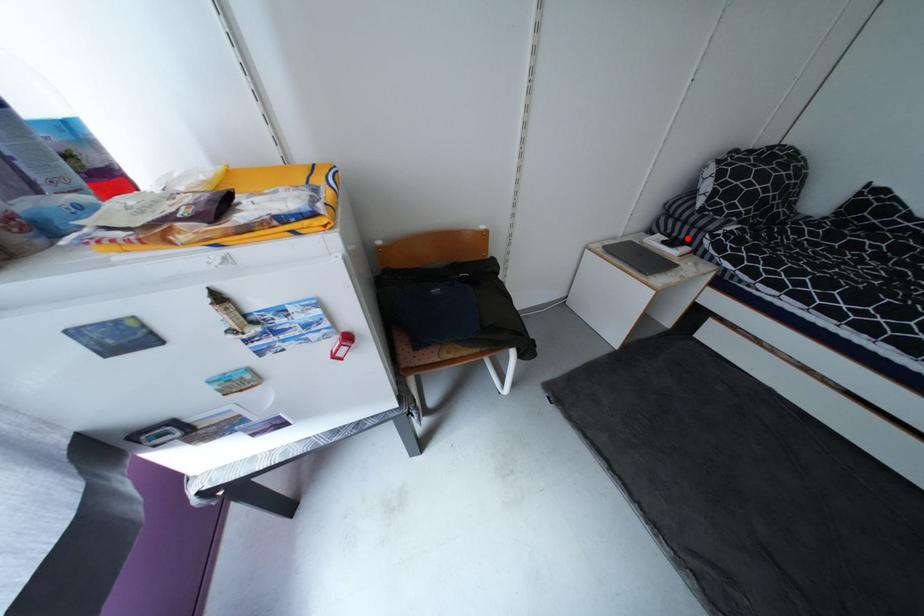
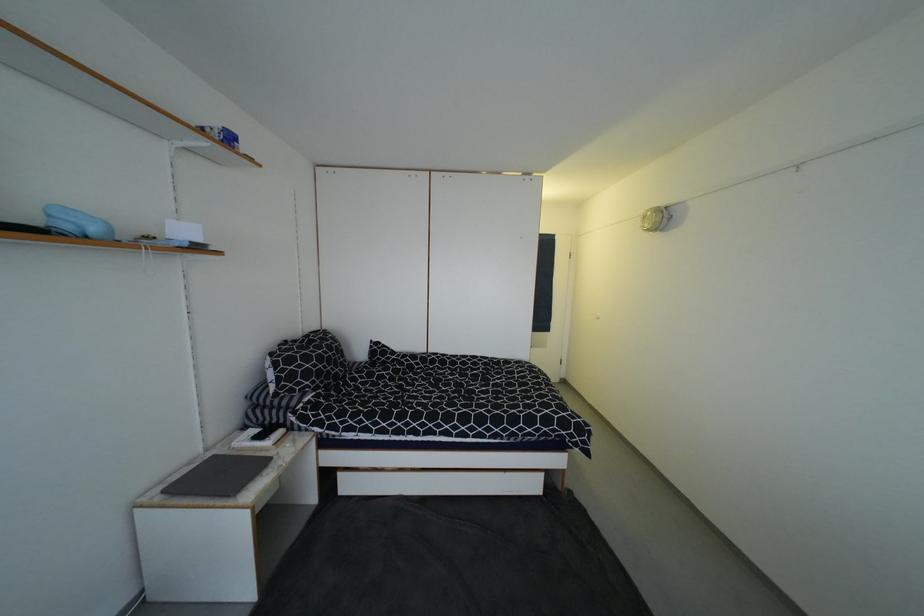
Find the pixel in the second image that matches the highlighted location in the first image.

(281, 423)